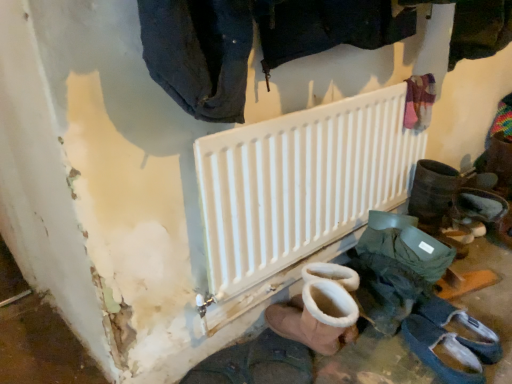
Where is `brown suede boot at lower center, which is counted as the 2th footwear, starting from the left`? The image size is (512, 384). brown suede boot at lower center, which is counted as the 2th footwear, starting from the left is located at coordinates (315, 319).

Measure the distance between dark blue denim jeans at upper center and camera.

dark blue denim jeans at upper center and camera are 30.39 inches apart.

In order to face dark brown leather boot at lower center, the first footwear in the left-to-right sequence, should I rotate leftwards or rightwards?

Rotate your view left by about 1.036°.

Identify the location of dark gray suede boot at lower right, which is counted as the 2th footwear, starting from the right. (444, 347).

Describe the element at coordinates (300, 183) in the screenshot. I see `white matte radiator at center` at that location.

In order to face dark gray suede shoes at lower right, acting as the first footwear starting from the right, should I rotate leftwards or rightwards?

You should look right and rotate roughly 25.582 degrees.

What is the approximate width of white suede boot at lower center, which ranks as the 3th footwear in right-to-left order?

It is 14.64 inches.

Identify the location of brown suede boot at lower center, which is counted as the 2th footwear, starting from the left. Image resolution: width=512 pixels, height=384 pixels. (315, 319).

Is dark gray suede shoes at lower right, which is counted as the fifth footwear, starting from the left, turned away from dark brown leather boot at lower center, which appears as the 5th footwear when viewed from the right?

No, dark gray suede shoes at lower right, which is counted as the fifth footwear, starting from the left,'s orientation is not away from dark brown leather boot at lower center, which appears as the 5th footwear when viewed from the right.

Would you say dark gray suede shoes at lower right, acting as the first footwear starting from the right, contains dark brown leather boot at lower center, which appears as the 5th footwear when viewed from the right?

That's incorrect, dark brown leather boot at lower center, which appears as the 5th footwear when viewed from the right, is not inside dark gray suede shoes at lower right, acting as the first footwear starting from the right.

Is dark gray suede shoes at lower right, acting as the first footwear starting from the right, closer to camera compared to dark brown leather boot at lower center, which appears as the 5th footwear when viewed from the right?

No.

Are dark gray suede shoes at lower right, which is counted as the fifth footwear, starting from the left, and dark brown leather boot at lower center, which appears as the 5th footwear when viewed from the right, far apart?

No.

Do you think dark blue denim jeans at upper center is within brown suede boot at lower center, which is counted as the 2th footwear, starting from the left, or outside of it?

dark blue denim jeans at upper center lies outside brown suede boot at lower center, which is counted as the 2th footwear, starting from the left.

Does dark blue denim jeans at upper center have a greater width compared to brown suede boot at lower center, placed as the fourth footwear when sorted from right to left?

No, dark blue denim jeans at upper center is not wider than brown suede boot at lower center, placed as the fourth footwear when sorted from right to left.

Between dark blue denim jeans at upper center and brown suede boot at lower center, placed as the fourth footwear when sorted from right to left, which one has larger size?

Bigger between the two is dark blue denim jeans at upper center.

At what (x,y) coordinates should I click in order to perform the action: click on clothing lying in front of the brown suede boot at lower center, which is counted as the 2th footwear, starting from the left. Please return your answer as a coordinate pair (x, y). This screenshot has height=384, width=512. Looking at the image, I should click on (199, 54).

Which is in front, white matte radiator at center or brown suede boot at lower center, which is counted as the 2th footwear, starting from the left?

white matte radiator at center is closer to the camera.

How distant is white matte radiator at center from brown suede boot at lower center, placed as the fourth footwear when sorted from right to left?

white matte radiator at center and brown suede boot at lower center, placed as the fourth footwear when sorted from right to left, are 13.30 inches apart from each other.

Is white matte radiator at center oriented towards brown suede boot at lower center, placed as the fourth footwear when sorted from right to left?

Yes, white matte radiator at center is turned towards brown suede boot at lower center, placed as the fourth footwear when sorted from right to left.

Visually, is white matte radiator at center positioned to the left or to the right of brown suede boot at lower center, placed as the fourth footwear when sorted from right to left?

Based on their positions, white matte radiator at center is located to the right of brown suede boot at lower center, placed as the fourth footwear when sorted from right to left.

Is point (450, 367) farther from viewer compared to point (384, 280)?

No, (450, 367) is closer to viewer.

Is dark gray suede boot at lower right, which is counted as the 2th footwear, starting from the right, turned away from white suede boot at lower center, the 3th footwear viewed from the left?

Yes, dark gray suede boot at lower right, which is counted as the 2th footwear, starting from the right, is positioned with its back facing white suede boot at lower center, the 3th footwear viewed from the left.

In the image, is dark gray suede boot at lower right, which ranks as the fourth footwear in left-to-right order, on the left side or the right side of white suede boot at lower center, the 3th footwear viewed from the left?

From the image, it's evident that dark gray suede boot at lower right, which ranks as the fourth footwear in left-to-right order, is to the right of white suede boot at lower center, the 3th footwear viewed from the left.

Which is behind, dark gray suede boot at lower right, which ranks as the fourth footwear in left-to-right order, or white suede boot at lower center, which ranks as the 3th footwear in right-to-left order?

Positioned behind is white suede boot at lower center, which ranks as the 3th footwear in right-to-left order.

Between dark gray suede shoes at lower right, acting as the first footwear starting from the right, and white matte radiator at center, which one has smaller size?

Smaller between the two is dark gray suede shoes at lower right, acting as the first footwear starting from the right.

Based on the photo, which object is wider, dark gray suede shoes at lower right, acting as the first footwear starting from the right, or white matte radiator at center?

A: dark gray suede shoes at lower right, acting as the first footwear starting from the right, is wider.

From a real-world perspective, is dark gray suede shoes at lower right, acting as the first footwear starting from the right, positioned over white matte radiator at center based on gravity?

No, from a real-world perspective, dark gray suede shoes at lower right, acting as the first footwear starting from the right, is not over white matte radiator at center

Between dark gray suede shoes at lower right, acting as the first footwear starting from the right, and brown suede boot at lower center, placed as the fourth footwear when sorted from right to left, which one has larger size?

brown suede boot at lower center, placed as the fourth footwear when sorted from right to left, is bigger.

Which is in front, point (461, 321) or point (324, 327)?

The point (324, 327) is in front.

Looking at this image, from a real-world perspective, is dark gray suede shoes at lower right, acting as the first footwear starting from the right, above or below brown suede boot at lower center, which is counted as the 2th footwear, starting from the left?

dark gray suede shoes at lower right, acting as the first footwear starting from the right, is situated lower than brown suede boot at lower center, which is counted as the 2th footwear, starting from the left, in the real world.

Is dark gray suede shoes at lower right, which is counted as the fifth footwear, starting from the left, far away from brown suede boot at lower center, placed as the fourth footwear when sorted from right to left?

Actually, dark gray suede shoes at lower right, which is counted as the fifth footwear, starting from the left, and brown suede boot at lower center, placed as the fourth footwear when sorted from right to left, are a little close together.

Which is more to the right, dark brown leather boot at lower center, which appears as the 5th footwear when viewed from the right, or dark gray suede shoes at lower right, which is counted as the fifth footwear, starting from the left?

Positioned to the right is dark gray suede shoes at lower right, which is counted as the fifth footwear, starting from the left.

Which is in front, point (289, 378) or point (461, 324)?

The point (289, 378) is in front.

Do you think dark brown leather boot at lower center, the first footwear in the left-to-right sequence, is within dark gray suede shoes at lower right, acting as the first footwear starting from the right, or outside of it?

dark brown leather boot at lower center, the first footwear in the left-to-right sequence, is not enclosed by dark gray suede shoes at lower right, acting as the first footwear starting from the right.

From the image's perspective, relative to dark gray suede shoes at lower right, which is counted as the fifth footwear, starting from the left, is dark brown leather boot at lower center, the first footwear in the left-to-right sequence, above or below?

dark brown leather boot at lower center, the first footwear in the left-to-right sequence, is below dark gray suede shoes at lower right, which is counted as the fifth footwear, starting from the left.

There is a dark brown leather boot at lower center, the first footwear in the left-to-right sequence. Where is `the 2nd footwear above it (from the image's perspective)`? the 2nd footwear above it (from the image's perspective) is located at coordinates (461, 327).

The image size is (512, 384). I want to click on clothing on the left side of brown suede boot at lower center, which is counted as the 2th footwear, starting from the left, so click(199, 54).

Based on their spatial positions, is white matte radiator at center or brown suede boot at lower center, which is counted as the 2th footwear, starting from the left, closer to dark gray suede shoes at lower right, acting as the first footwear starting from the right?

brown suede boot at lower center, which is counted as the 2th footwear, starting from the left, is closer to dark gray suede shoes at lower right, acting as the first footwear starting from the right.

Estimate the real-world distances between objects in this image. Which object is further from dark blue denim jeans at upper center, dark brown leather boot at lower center, which appears as the 5th footwear when viewed from the right, or white suede boot at lower center, the 3th footwear viewed from the left?

dark brown leather boot at lower center, which appears as the 5th footwear when viewed from the right, is further to dark blue denim jeans at upper center.

Looking at the image, which one is located further to white suede boot at lower center, the 3th footwear viewed from the left, white matte radiator at center or brown suede boot at lower center, which is counted as the 2th footwear, starting from the left?

Among the two, white matte radiator at center is located further to white suede boot at lower center, the 3th footwear viewed from the left.

Estimate the real-world distances between objects in this image. Which object is closer to dark blue denim jeans at upper center, dark gray suede boot at lower right, which is counted as the 2th footwear, starting from the right, or white matte radiator at center?

The object closer to dark blue denim jeans at upper center is white matte radiator at center.

Considering their positions, is brown suede boot at lower center, placed as the fourth footwear when sorted from right to left, positioned closer to dark blue denim jeans at upper center than dark gray suede boot at lower right, which ranks as the fourth footwear in left-to-right order?

Based on the image, brown suede boot at lower center, placed as the fourth footwear when sorted from right to left, appears to be nearer to dark blue denim jeans at upper center.

From the image, which object appears to be farther from dark gray suede shoes at lower right, which is counted as the fifth footwear, starting from the left, dark blue denim jeans at upper center or dark gray suede boot at lower right, which ranks as the fourth footwear in left-to-right order?

dark blue denim jeans at upper center is positioned further to the anchor dark gray suede shoes at lower right, which is counted as the fifth footwear, starting from the left.

Based on their spatial positions, is white matte radiator at center or dark gray suede boot at lower right, which is counted as the 2th footwear, starting from the right, closer to white suede boot at lower center, the 3th footwear viewed from the left?

dark gray suede boot at lower right, which is counted as the 2th footwear, starting from the right, lies closer to white suede boot at lower center, the 3th footwear viewed from the left, than the other object.

Which object lies further to the anchor point white suede boot at lower center, which ranks as the 3th footwear in right-to-left order, dark gray suede shoes at lower right, which is counted as the fifth footwear, starting from the left, or dark blue denim jeans at upper center?

Among the two, dark blue denim jeans at upper center is located further to white suede boot at lower center, which ranks as the 3th footwear in right-to-left order.

This screenshot has height=384, width=512. What are the coordinates of `radiator located between dark blue denim jeans at upper center and dark gray suede shoes at lower right, which is counted as the fifth footwear, starting from the left, in the left-right direction` in the screenshot? It's located at (x=300, y=183).

I want to click on footwear between white matte radiator at center and brown suede boot at lower center, placed as the fourth footwear when sorted from right to left, vertically, so click(396, 268).

In order to click on radiator between dark blue denim jeans at upper center and dark gray suede boot at lower right, which ranks as the fourth footwear in left-to-right order, vertically in this screenshot , I will do `click(300, 183)`.

The width and height of the screenshot is (512, 384). What are the coordinates of `radiator between dark blue denim jeans at upper center and brown suede boot at lower center, placed as the fourth footwear when sorted from right to left, in the up-down direction` in the screenshot? It's located at (300, 183).